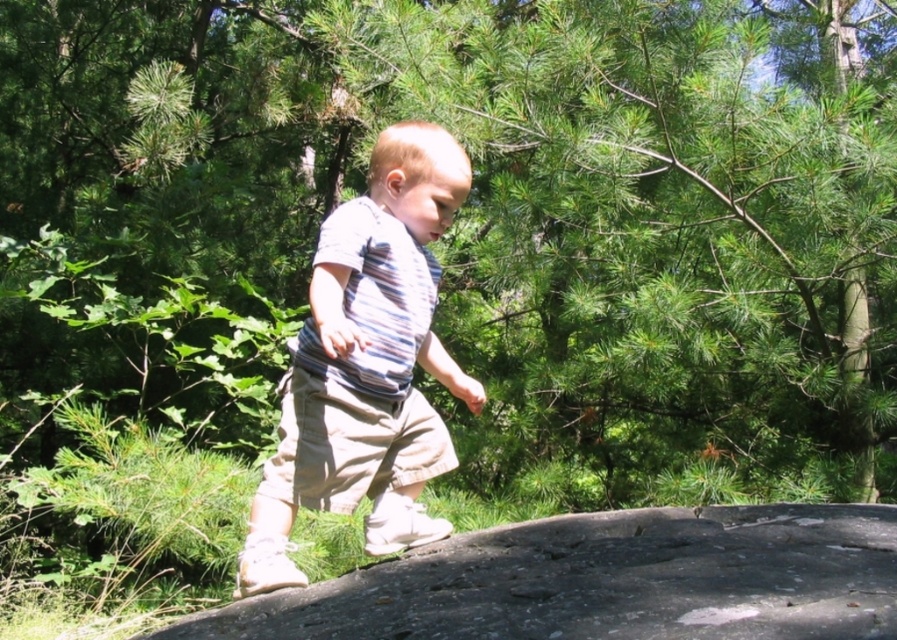
Consider the image. You are a hiker navigating through the forest and come across a smooth gray rock at center. If you want to place a small backpack on the ground near this rock, where should you position it relative to the rock?

The smooth gray rock at center is located at point (605, 580), so you should position the backpack near that coordinate to place it close to the rock.

You are a parent watching your child in the forest. You see the smooth gray rock at center and the striped cotton shirt at center. Which object is positioned to the right of the other?

The smooth gray rock at center is to the right of striped cotton shirt at center.

You are a hiker who wants to sit down. You see a smooth gray rock at center and a striped cotton shirt at center. Which object is shorter and can be used as a seat?

The smooth gray rock at center is shorter than the striped cotton shirt at center, so it can be used as a seat.